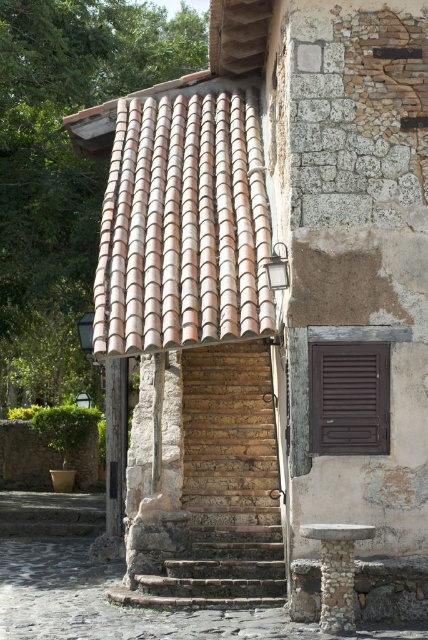
Question: Which of the following is the closest to the observer?

Choices:
 (A) brown matte shutter at right
 (B) smooth stone balustrade at lower right
 (C) stone textured stairs at center

Answer: (B)

Question: From the image, what is the correct spatial relationship of brown matte shutter at right in relation to smooth stone balustrade at lower right?

Choices:
 (A) right
 (B) left

Answer: (A)

Question: Is the position of stone textured stairs at center less distant than that of smooth stone balustrade at lower right?

Choices:
 (A) yes
 (B) no

Answer: (B)

Question: Considering the real-world distances, which object is closest to the stone textured stairs at center?

Choices:
 (A) smooth stone balustrade at lower right
 (B) terracotta tiles at upper left

Answer: (A)

Question: Considering the real-world distances, which object is farthest from the brown matte shutter at right?

Choices:
 (A) stone textured stairs at center
 (B) terracotta tiles at upper left
 (C) smooth stone balustrade at lower right

Answer: (A)

Question: Observing the image, what is the correct spatial positioning of brown matte shutter at right in reference to smooth stone balustrade at lower right?

Choices:
 (A) left
 (B) right

Answer: (B)